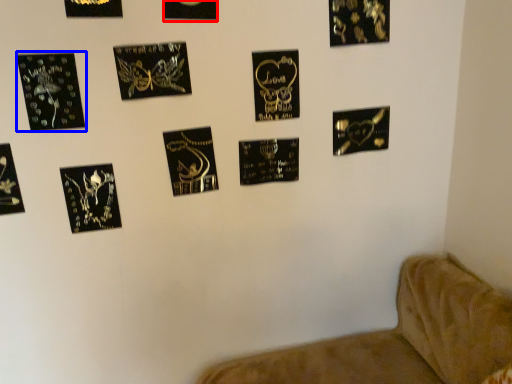
Question: Which point is closer to the camera, picture frame (highlighted by a red box) or picture frame (highlighted by a blue box)?

Choices:
 (A) picture frame
 (B) picture frame

Answer: (B)